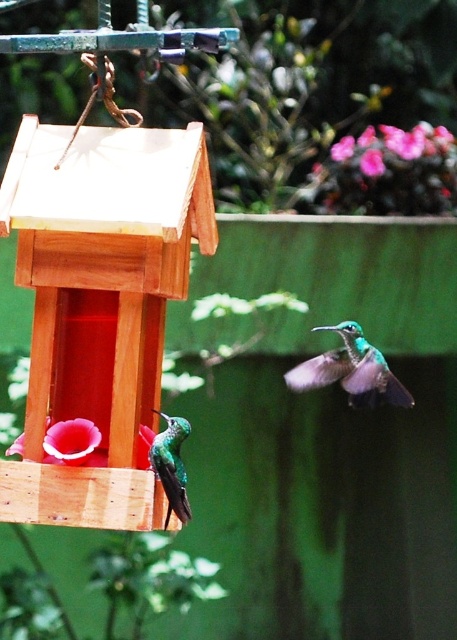
Can you confirm if green iridescent hummingbird at lower left is positioned above pink matte flower at lower left?

No.

Which is more to the right, green iridescent hummingbird at lower left or pink matte flower at lower left?

From the viewer's perspective, green iridescent hummingbird at lower left appears more on the right side.

The height and width of the screenshot is (640, 457). Describe the element at coordinates (171, 465) in the screenshot. I see `green iridescent hummingbird at lower left` at that location.

Identify the location of green iridescent hummingbird at lower left. The width and height of the screenshot is (457, 640). (171, 465).

Is pink matte flower at lower left shorter than pink matte flower at upper center?

Yes.

Can you confirm if pink matte flower at lower left is thinner than pink matte flower at upper center?

In fact, pink matte flower at lower left might be wider than pink matte flower at upper center.

Is point (67, 451) positioned behind point (340, 150)?

No.

Locate an element on the screen. The height and width of the screenshot is (640, 457). pink matte flower at lower left is located at coordinates (70, 442).

Does green iridescent hummingbird at lower left appear on the right side of pink matte flower at upper center?

In fact, green iridescent hummingbird at lower left is to the left of pink matte flower at upper center.

Is green iridescent hummingbird at lower left positioned before pink matte flower at upper center?

Yes, it is in front of pink matte flower at upper center.

What do you see at coordinates (171, 465) in the screenshot?
I see `green iridescent hummingbird at lower left` at bounding box center [171, 465].

The height and width of the screenshot is (640, 457). In order to click on green iridescent hummingbird at lower left in this screenshot , I will do `click(171, 465)`.